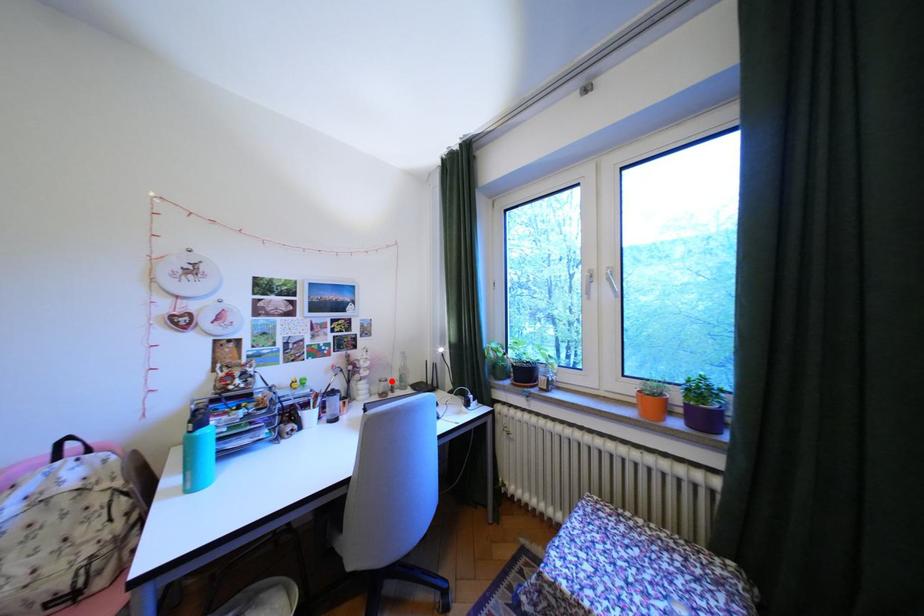
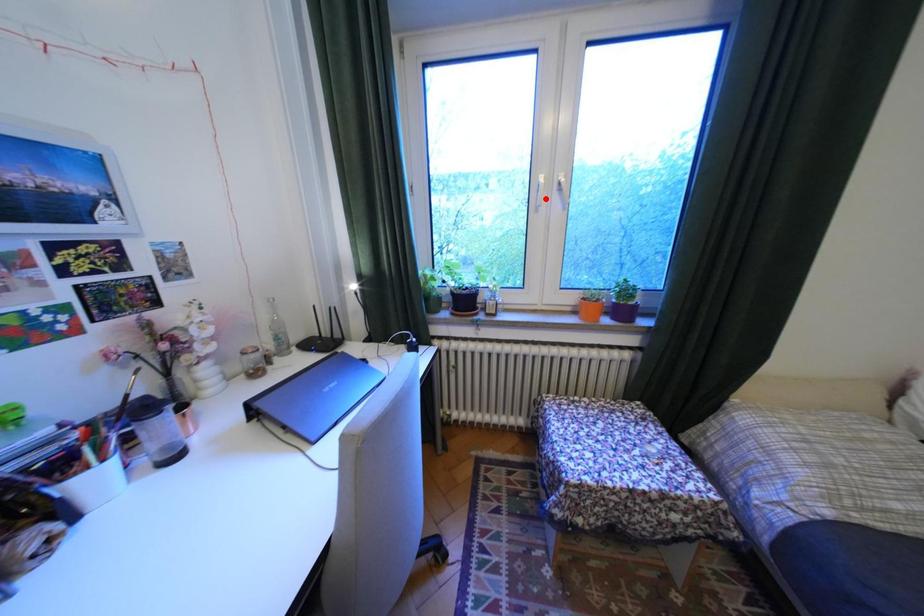
I am providing you with two images of the same scene from different viewpoints. A red point is marked on the first image and another point is marked on the second image. Does the point marked in image1 correspond to the same location as the one in image2?

No